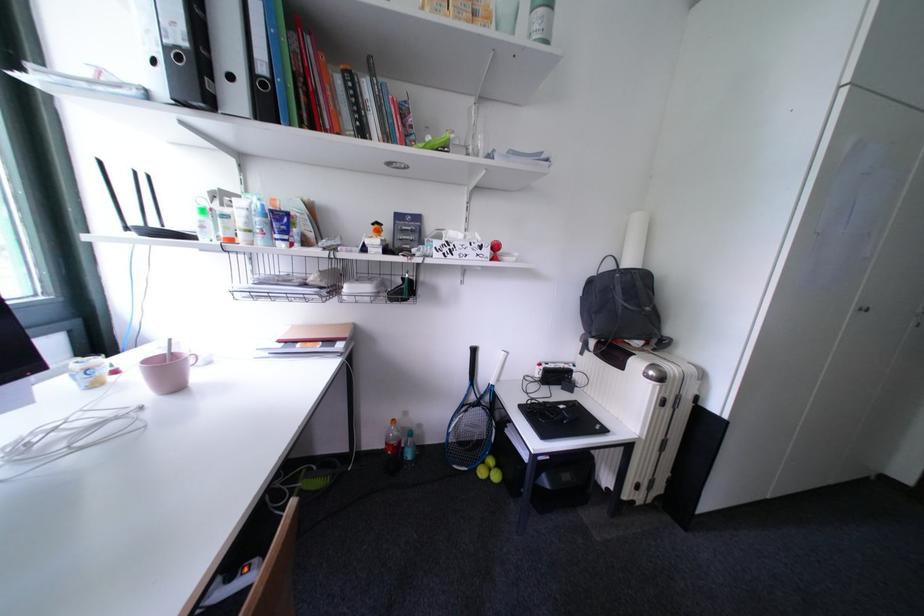
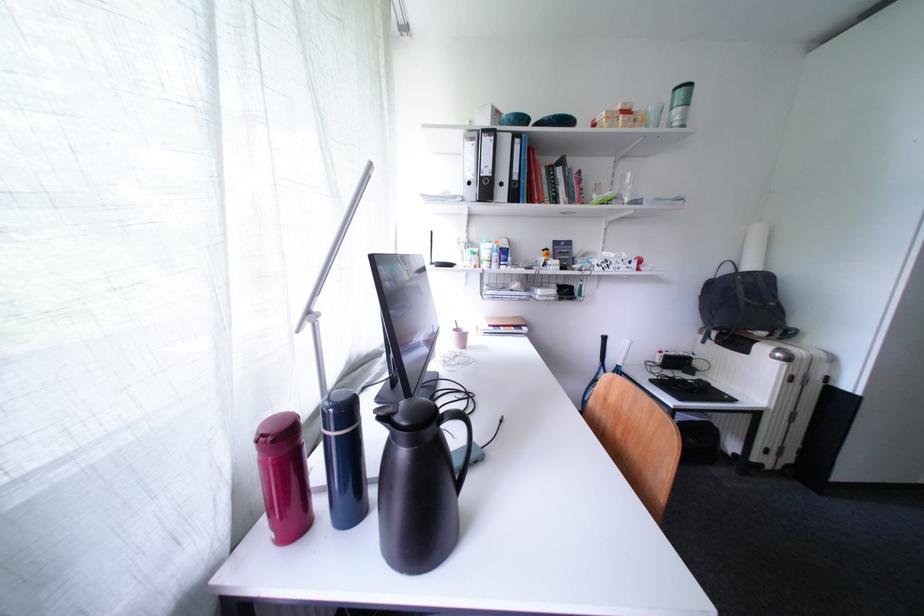
Question: The camera is either moving clockwise (left) or counter-clockwise (right) around the object. The first image is from the beginning of the video and the second image is from the end. Is the camera moving left or right when shooting the video?

Choices:
 (A) Left
 (B) Right

Answer: (B)